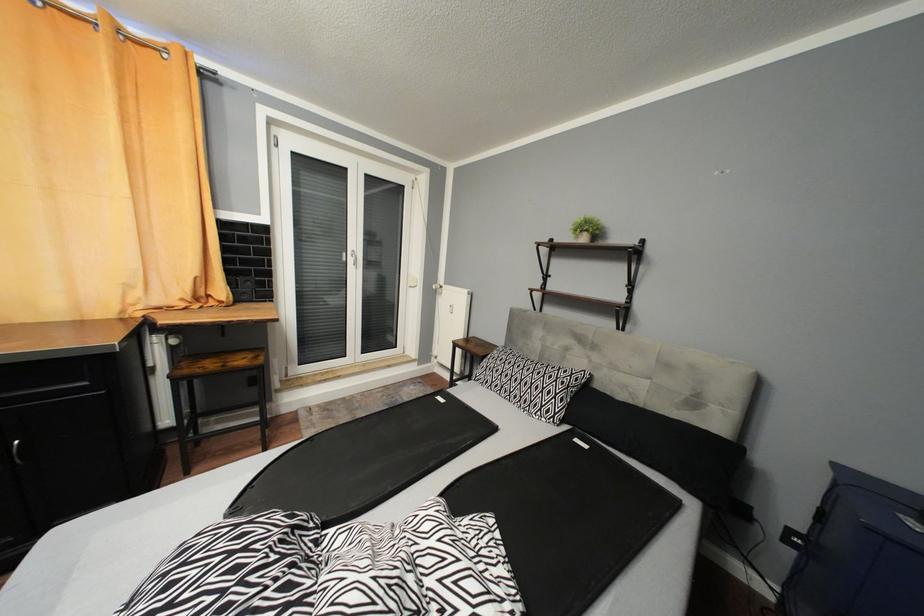
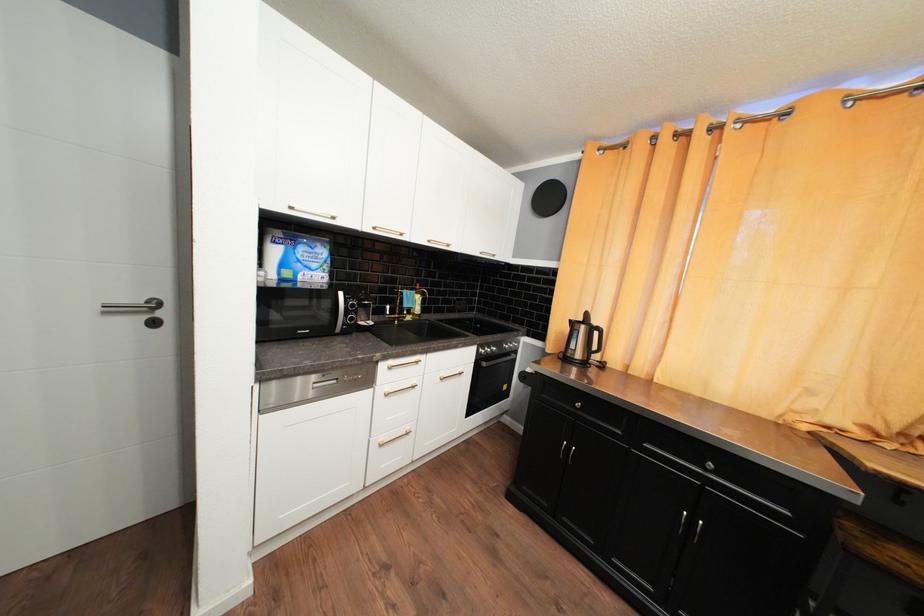
Question: Based on the continuous images, in which direction is the camera rotating? Reply with the corresponding letter.

Choices:
 (A) Left
 (B) Right
 (C) Up
 (D) Down

Answer: (A)